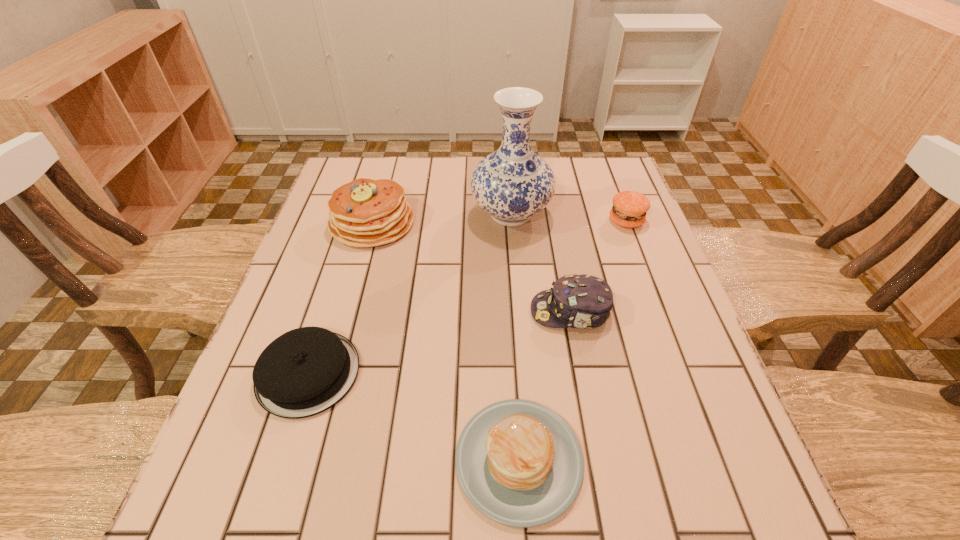
Identify the location of vacant space located on the front-facing side of the headwear. (508, 312).

Identify the location of free space located on the front of the patty. The width and height of the screenshot is (960, 540). pyautogui.click(x=656, y=299).

Where is `vacant space positioned on the right of the rightmost pancake`? vacant space positioned on the right of the rightmost pancake is located at coordinates 695,460.

Where is `vase that is at the far edge`? The height and width of the screenshot is (540, 960). vase that is at the far edge is located at coordinates (512, 184).

At what (x,y) coordinates should I click in order to perform the action: click on pancake that is at the far edge. Please return your answer as a coordinate pair (x, y). The height and width of the screenshot is (540, 960). Looking at the image, I should click on (365, 212).

Identify the location of object that is at the near edge. (519, 463).

At what (x,y) coordinates should I click in order to perform the action: click on headwear that is at the right edge. Please return your answer as a coordinate pair (x, y). Looking at the image, I should click on 578,301.

Identify the location of patty at the right edge. (629, 209).

At what (x,y) coordinates should I click in order to perform the action: click on object situated at the far left corner. Please return your answer as a coordinate pair (x, y). Looking at the image, I should click on (365, 212).

Where is `vacant area at the near edge`? vacant area at the near edge is located at coordinates (335, 489).